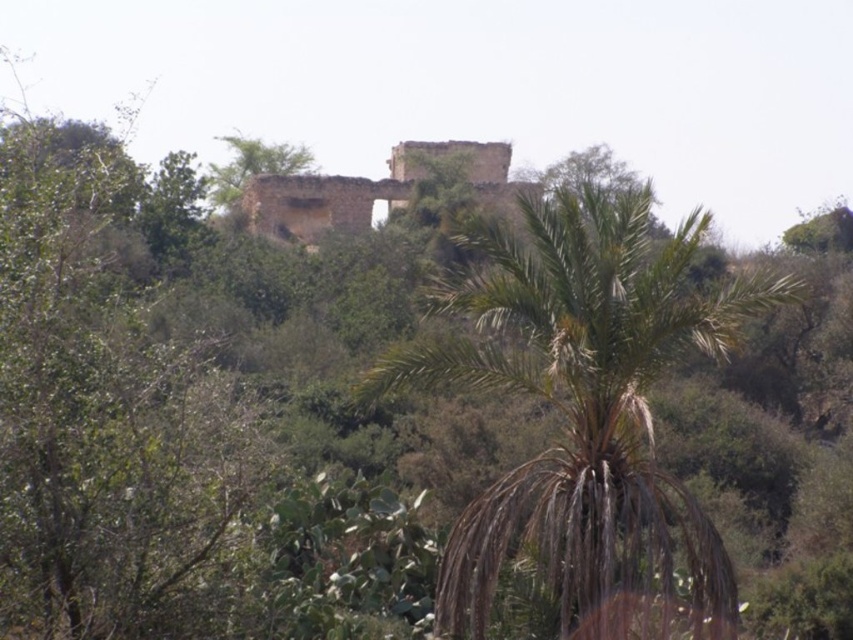
You are standing in front of the landscape scene and want to take a photo. You notice two points marked in the image. Which point, point (625, 308) or point (293, 208), is closer to you?

Point (625, 308) is closer to the camera than point (293, 208).

You are standing in the landscape described. There is a point marked at coordinates (582,408). What object is located at that point?

The point at coordinates (582,408) indicates the brown textured palm tree at center.

You are planning to plant a new tree in your backyard. You have a brown textured palm tree at center and a weathered stone castle at center in the image. Which object is more suitable for a small backyard space?

The brown textured palm tree at center is more suitable for a small backyard space since it has a smaller size compared to the weathered stone castle at center.